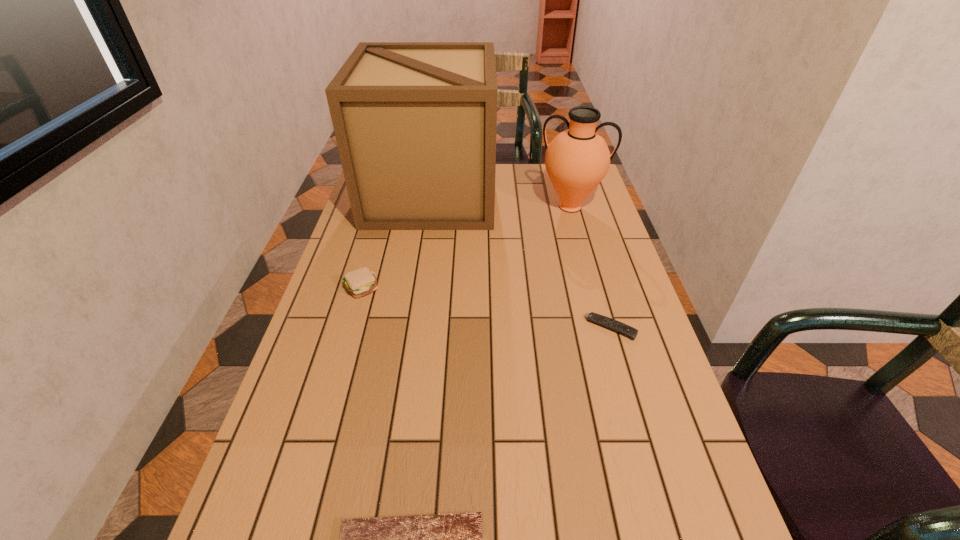
At what (x,y) coordinates should I click in order to perform the action: click on box. Please return your answer as a coordinate pair (x, y). The width and height of the screenshot is (960, 540). Looking at the image, I should click on (415, 123).

Identify the location of pitcher. This screenshot has height=540, width=960. [577, 159].

Find the location of `the third shortest object`. the third shortest object is located at coordinates (359, 282).

This screenshot has height=540, width=960. In order to click on the third nearest object in this screenshot , I will do `click(359, 282)`.

I want to click on the shortest object, so click(621, 328).

Find the location of a particular element. The image size is (960, 540). the second nearest object is located at coordinates (621, 328).

Locate an element on the screen. The image size is (960, 540). vacant region located 0.260m on the reinforced sides of the tallest object is located at coordinates (561, 194).

Locate an element on the screen. The height and width of the screenshot is (540, 960). free location located on the front of the fourth shortest object is located at coordinates (578, 235).

In order to click on vacant space located on the back of the third farthest object in this screenshot , I will do `click(373, 246)`.

This screenshot has width=960, height=540. What are the coordinates of `blank space located 0.120m on the back of the remote control` in the screenshot? It's located at [x=599, y=285].